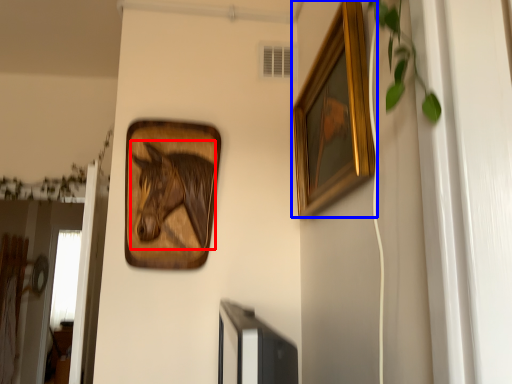
Question: Which object appears closest to the camera in this image, animal (highlighted by a red box) or picture frame (highlighted by a blue box)?

Choices:
 (A) animal
 (B) picture frame

Answer: (B)